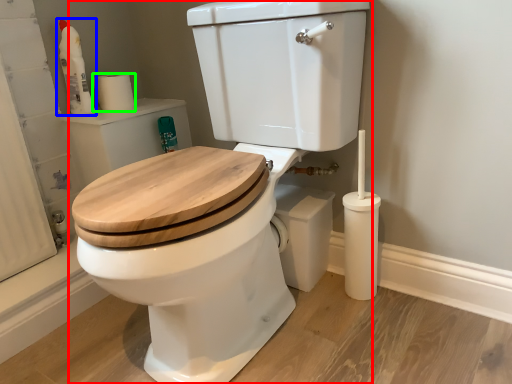
Question: Which is farther away from toilet (highlighted by a red box)? cleaning product (highlighted by a blue box) or toilet paper (highlighted by a green box)?

Choices:
 (A) cleaning product
 (B) toilet paper

Answer: (A)